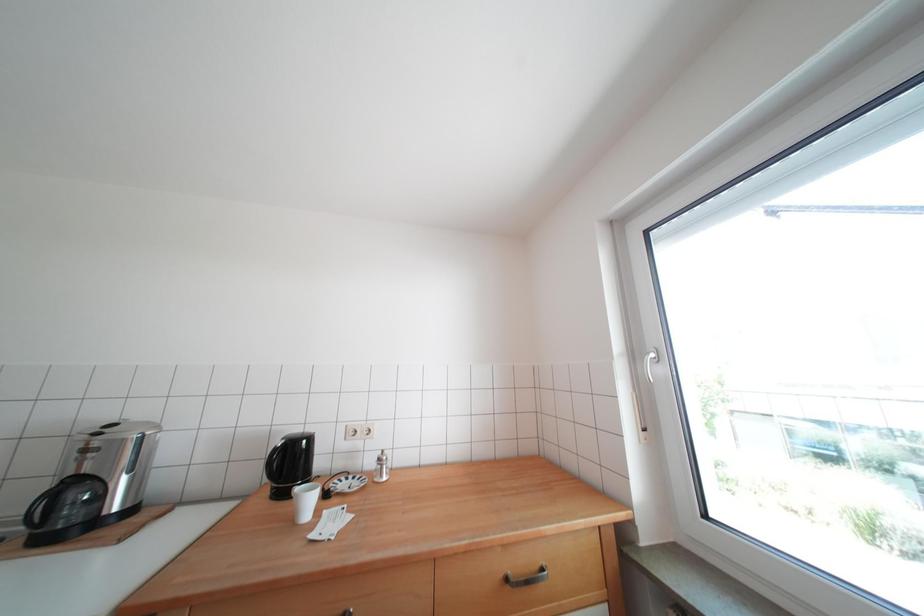
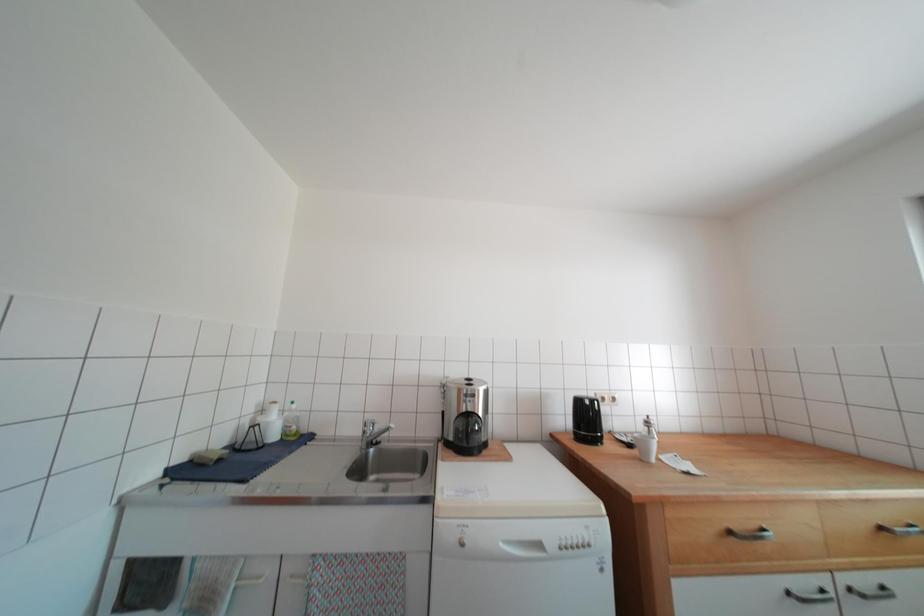
Question: In a continuous first-person perspective shot, in which direction is the camera moving?

Choices:
 (A) Left
 (B) Right
 (C) Forward
 (D) Backward

Answer: (A)